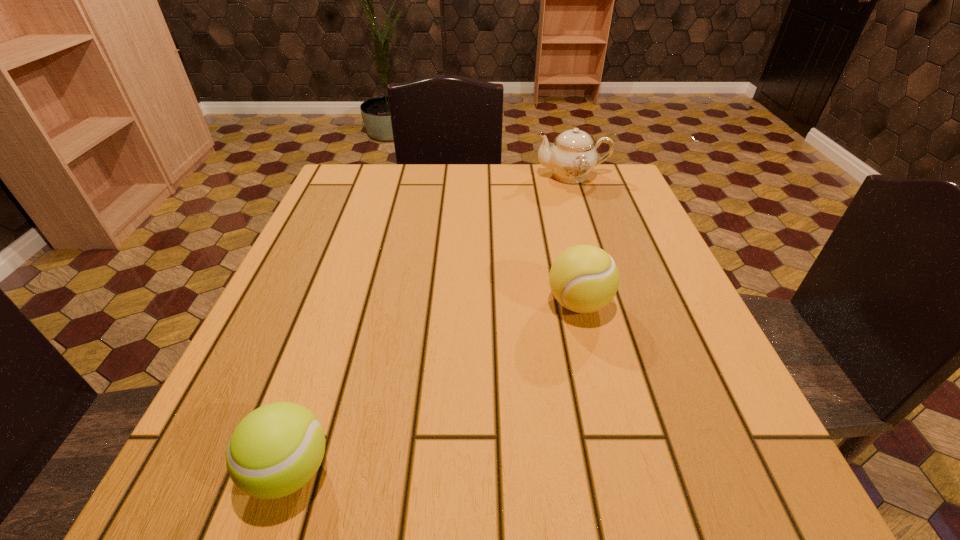
Where is `empty location between the nearest object and the right tennis ball`? This screenshot has width=960, height=540. empty location between the nearest object and the right tennis ball is located at coordinates (434, 387).

Locate an element on the screen. Image resolution: width=960 pixels, height=540 pixels. free space between the farthest object and the leftmost object is located at coordinates (431, 323).

Locate an element on the screen. vacant area that lies between the left tennis ball and the right tennis ball is located at coordinates (434, 387).

Locate an element on the screen. This screenshot has width=960, height=540. free space that is in between the leftmost object and the chinaware is located at coordinates (431, 323).

Select which object appears as the closest to the farther tennis ball. Please provide its 2D coordinates. Your answer should be formatted as a tuple, i.e. [(x, y)], where the tuple contains the x and y coordinates of a point satisfying the conditions above.

[(572, 156)]

Locate which object ranks second in proximity to the farthest object. Please provide its 2D coordinates. Your answer should be formatted as a tuple, i.e. [(x, y)], where the tuple contains the x and y coordinates of a point satisfying the conditions above.

[(276, 449)]

Locate an element on the screen. The image size is (960, 540). vacant space that satisfies the following two spatial constraints: 1. on the back side of the right tennis ball; 2. on the left side of the leftmost object is located at coordinates (345, 303).

The width and height of the screenshot is (960, 540). In order to click on blank area in the image that satisfies the following two spatial constraints: 1. at the spout of the farthest object; 2. on the front side of the left tennis ball in this screenshot , I will do [667, 470].

The image size is (960, 540). In order to click on vacant space that satisfies the following two spatial constraints: 1. at the spout of the farthest object; 2. on the front side of the left tennis ball in this screenshot , I will do `click(667, 470)`.

In order to click on blank space that satisfies the following two spatial constraints: 1. at the spout of the chinaware; 2. on the front side of the right tennis ball in this screenshot , I will do `click(613, 303)`.